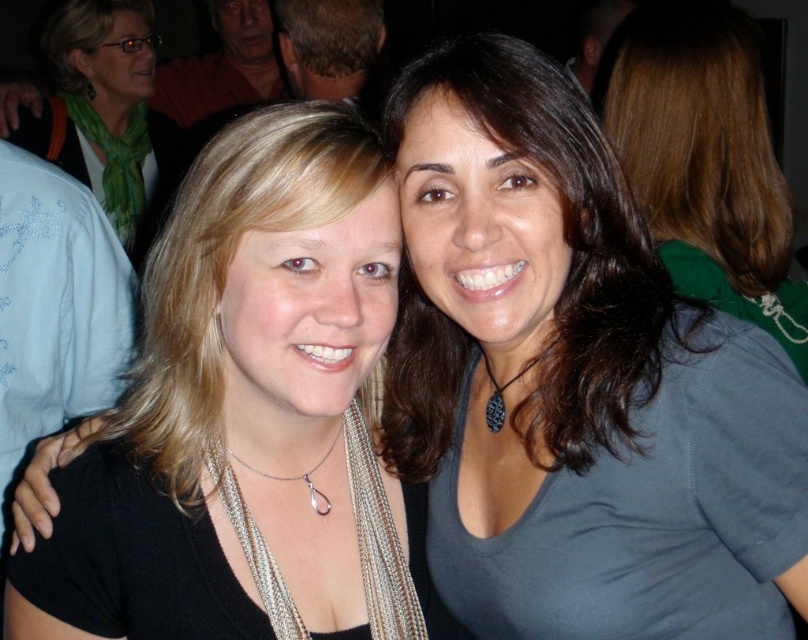
You are a photographer trying to adjust the lighting for a portrait. You notice the dark brown hair at center and the green scarf at upper left in your frame. Which object should you focus on first if you want to ensure proper exposure for the closer subject?

The dark brown hair at center is closer to the viewer than the green scarf at upper left, so you should focus on the dark brown hair at center first to ensure proper exposure for the closer subject.